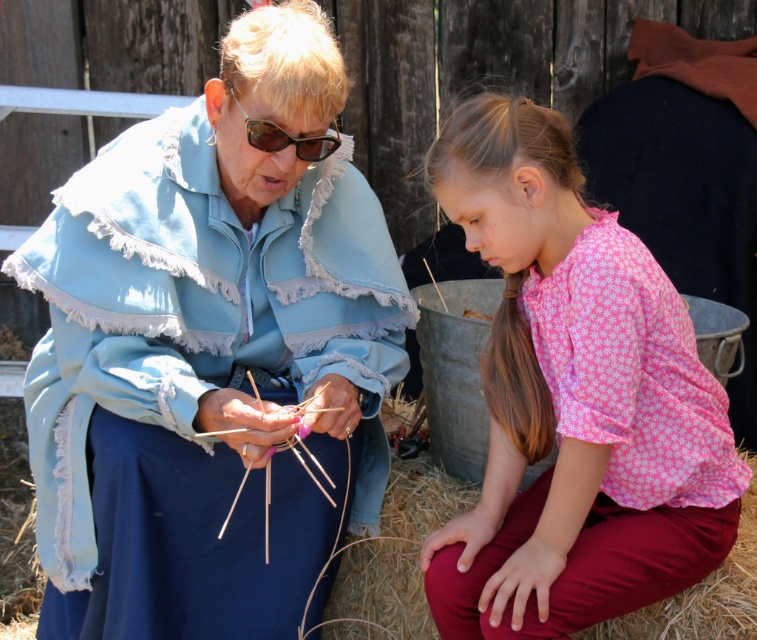
Question: Estimate the real-world distances between objects in this image. Which object is farther from the pink floral shirt at lower right?

Choices:
 (A) light blue fabric at center
 (B) matte black goggles at upper center

Answer: (B)

Question: Observing the image, what is the correct spatial positioning of light blue fabric at center in reference to pink floral shirt at lower right?

Choices:
 (A) below
 (B) above

Answer: (A)

Question: Can you confirm if pink floral shirt at lower right is positioned below matte black goggles at upper center?

Choices:
 (A) no
 (B) yes

Answer: (B)

Question: Among these points, which one is farthest from the camera?

Choices:
 (A) (397, 275)
 (B) (276, 145)

Answer: (A)

Question: Observing the image, what is the correct spatial positioning of light blue fabric at center in reference to matte black goggles at upper center?

Choices:
 (A) below
 (B) above

Answer: (A)

Question: Which point appears farthest from the camera in this image?

Choices:
 (A) (322, 144)
 (B) (67, 198)

Answer: (A)